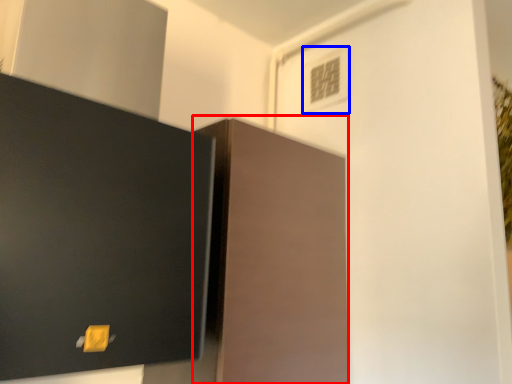
Question: Among these objects, which one is nearest to the camera, cabinetry (highlighted by a red box) or light switch (highlighted by a blue box)?

Choices:
 (A) cabinetry
 (B) light switch

Answer: (A)